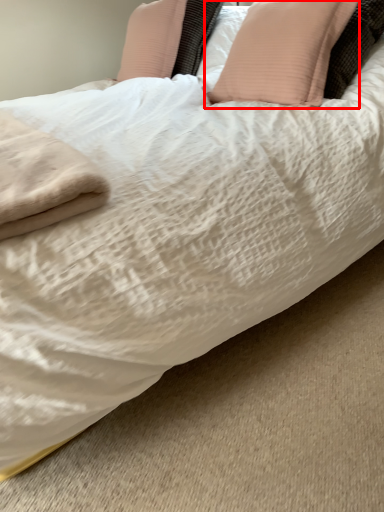
Question: From the image's perspective, considering the relative positions of pillow (annotated by the red box) and pillow in the image provided, where is pillow (annotated by the red box) located with respect to the staircase?

Choices:
 (A) above
 (B) below

Answer: (B)